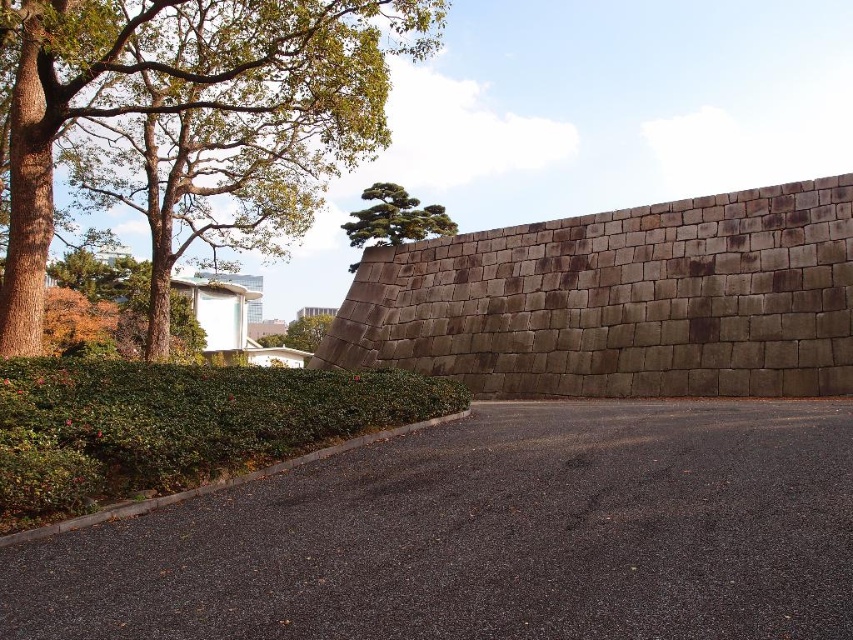
Consider the image. Does green leafy tree at left have a larger size compared to green leafy tree at center?

Correct, green leafy tree at left is larger in size than green leafy tree at center.

Is green leafy tree at left to the left of green leafy tree at center from the viewer's perspective?

Incorrect, green leafy tree at left is not on the left side of green leafy tree at center.

Is point (329, 54) positioned behind point (300, 344)?

No, (329, 54) is in front of (300, 344).

Identify the location of green leafy tree at left. (189, 90).

Between green textured stone wall at upper center and green leafy tree at center, which one is positioned higher?

Positioned higher is green textured stone wall at upper center.

Who is more forward, (367, 193) or (322, 314)?

Point (367, 193) is in front.

Find the location of a particular element. green textured stone wall at upper center is located at coordinates (395, 218).

Where is `green textured stone wall at upper center`? Image resolution: width=853 pixels, height=640 pixels. green textured stone wall at upper center is located at coordinates (395, 218).

Is green leafy hedge at lower left to the left of green leafy tree at center from the viewer's perspective?

In fact, green leafy hedge at lower left is to the right of green leafy tree at center.

Measure the distance from green leafy hedge at lower left to green leafy tree at center.

green leafy hedge at lower left and green leafy tree at center are 153.64 feet apart from each other.

Between point (405, 403) and point (264, 339), which one is positioned behind?

The point (264, 339) is behind.

Where is `green leafy hedge at lower left`? green leafy hedge at lower left is located at coordinates (178, 424).